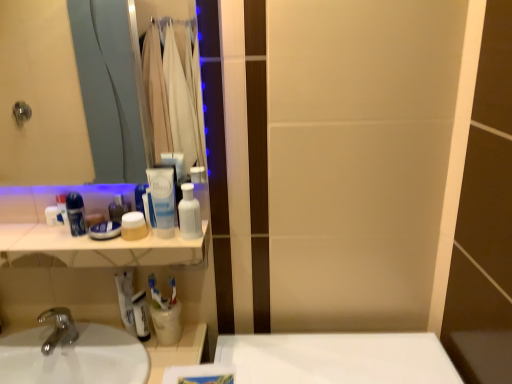
Question: Is matte beige jar at center, which is the 4th mouthwash from left to right, facing away from translucent plastic mouthwash at center, acting as the sixth mouthwash starting from the left?

Choices:
 (A) yes
 (B) no

Answer: (B)

Question: Is matte beige jar at center, which is the 4th mouthwash from left to right, positioned before translucent plastic mouthwash at center, the 2th mouthwash when ordered from right to left?

Choices:
 (A) no
 (B) yes

Answer: (A)

Question: Considering the relative sizes of matte beige jar at center, which is the 4th mouthwash from left to right, and translucent plastic mouthwash at center, the 2th mouthwash when ordered from right to left, in the image provided, is matte beige jar at center, which is the 4th mouthwash from left to right, shorter than translucent plastic mouthwash at center, the 2th mouthwash when ordered from right to left,?

Choices:
 (A) yes
 (B) no

Answer: (A)

Question: From a real-world perspective, is matte beige jar at center, which is counted as the fourth mouthwash, starting from the right, beneath translucent plastic mouthwash at center, acting as the sixth mouthwash starting from the left?

Choices:
 (A) yes
 (B) no

Answer: (A)

Question: Is matte beige jar at center, which is counted as the fourth mouthwash, starting from the right, at the right side of translucent plastic mouthwash at center, acting as the sixth mouthwash starting from the left?

Choices:
 (A) yes
 (B) no

Answer: (B)

Question: In terms of height, does silver metallic faucet at lower left look taller or shorter compared to white plastic toothbrush at lower center?

Choices:
 (A) tall
 (B) short

Answer: (A)

Question: In the image, is silver metallic faucet at lower left positioned in front of or behind white plastic toothbrush at lower center?

Choices:
 (A) behind
 (B) front

Answer: (B)

Question: Is silver metallic faucet at lower left wider or thinner than white plastic toothbrush at lower center?

Choices:
 (A) wide
 (B) thin

Answer: (A)

Question: Visually, is silver metallic faucet at lower left positioned to the left or to the right of white plastic toothbrush at lower center?

Choices:
 (A) right
 (B) left

Answer: (B)

Question: Looking at their shapes, would you say blue glossy mouthwash at left, the 6th mouthwash when ordered from right to left, is wider or thinner than silver metallic faucet at lower left?

Choices:
 (A) thin
 (B) wide

Answer: (A)

Question: Is blue glossy mouthwash at left, the second mouthwash viewed from the left, inside the boundaries of silver metallic faucet at lower left, or outside?

Choices:
 (A) inside
 (B) outside

Answer: (B)

Question: In the image, is blue glossy mouthwash at left, the 6th mouthwash when ordered from right to left, on the left side or the right side of silver metallic faucet at lower left?

Choices:
 (A) right
 (B) left

Answer: (A)

Question: Considering the positions of blue glossy mouthwash at left, the second mouthwash viewed from the left, and silver metallic faucet at lower left in the image, is blue glossy mouthwash at left, the second mouthwash viewed from the left, taller or shorter than silver metallic faucet at lower left?

Choices:
 (A) short
 (B) tall

Answer: (B)

Question: Is blue plastic mouthwash at left, which appears as the 1th mouthwash when viewed from the left, to the left or to the right of white glossy counter top at upper left in the image?

Choices:
 (A) right
 (B) left

Answer: (B)

Question: Considering the positions of blue plastic mouthwash at left, the 7th mouthwash when ordered from right to left, and white glossy counter top at upper left in the image, is blue plastic mouthwash at left, the 7th mouthwash when ordered from right to left, taller or shorter than white glossy counter top at upper left?

Choices:
 (A) short
 (B) tall

Answer: (B)